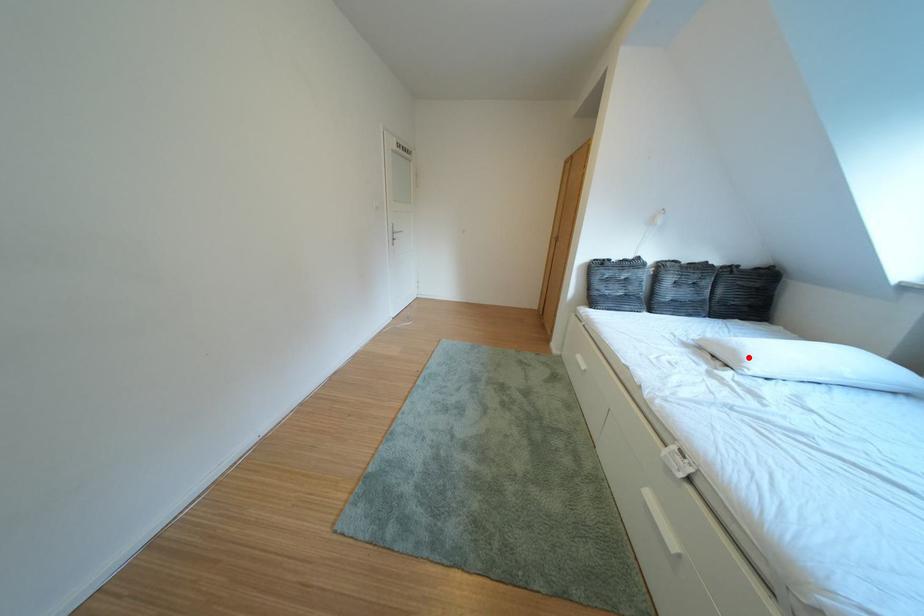
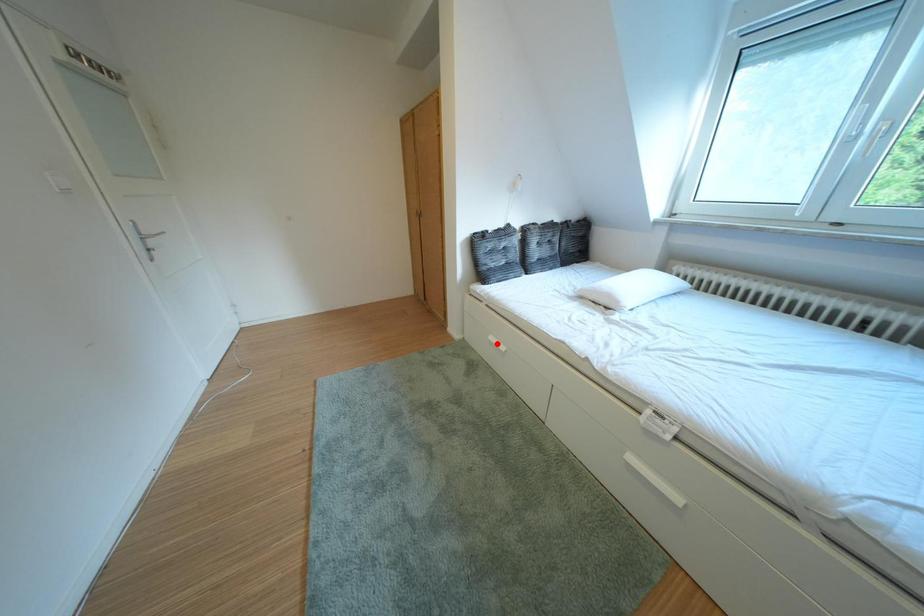
Based on the photo, I am providing you with two images of the same scene from different viewpoints. A red point is marked on the first image and another point is marked on the second image. Is the marked point in image1 the same physical position as the marked point in image2?

No